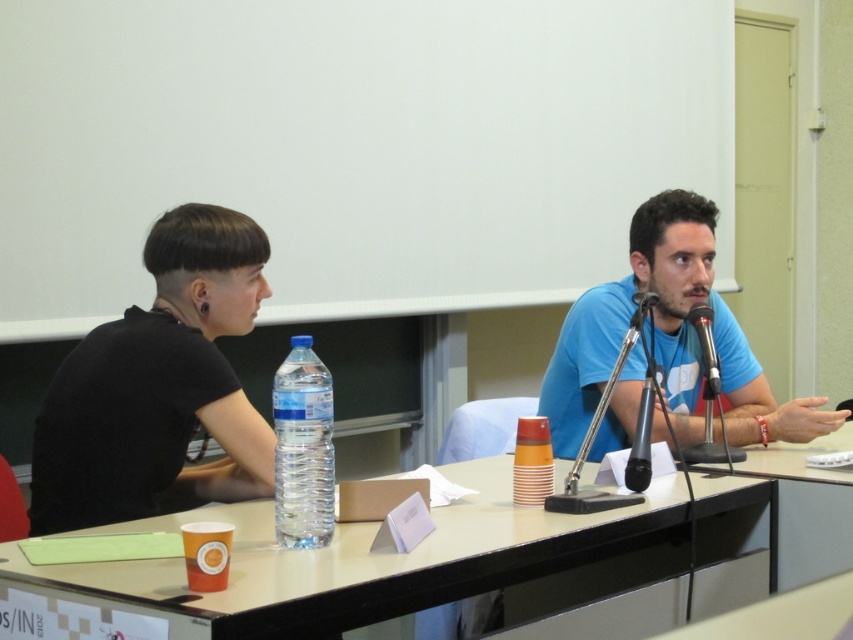
Who is more distant from viewer, (119, 342) or (784, 480)?

Positioned behind is point (784, 480).

Identify the location of black matte shirt at left. (158, 385).

This screenshot has height=640, width=853. Describe the element at coordinates (158, 385) in the screenshot. I see `black matte shirt at left` at that location.

Image resolution: width=853 pixels, height=640 pixels. Find the location of `black matte shirt at left`. black matte shirt at left is located at coordinates (158, 385).

Which is behind, point (300, 513) or point (647, 481)?

Point (647, 481)

Who is more forward, (297, 513) or (639, 442)?

Point (297, 513)

Is point (310, 364) farther from viewer compared to point (648, 378)?

No.

The height and width of the screenshot is (640, 853). Identify the location of clear plastic bottle at center. (303, 449).

Is blue matte shirt at center bigger than black metallic microphone at center?

Correct, blue matte shirt at center is larger in size than black metallic microphone at center.

Can you confirm if blue matte shirt at center is smaller than black metallic microphone at center?

Actually, blue matte shirt at center might be larger than black metallic microphone at center.

Does point (616, 396) lie behind point (717, 372)?

Yes, point (616, 396) is behind point (717, 372).

Image resolution: width=853 pixels, height=640 pixels. Find the location of `blue matte shirt at center`. blue matte shirt at center is located at coordinates (669, 339).